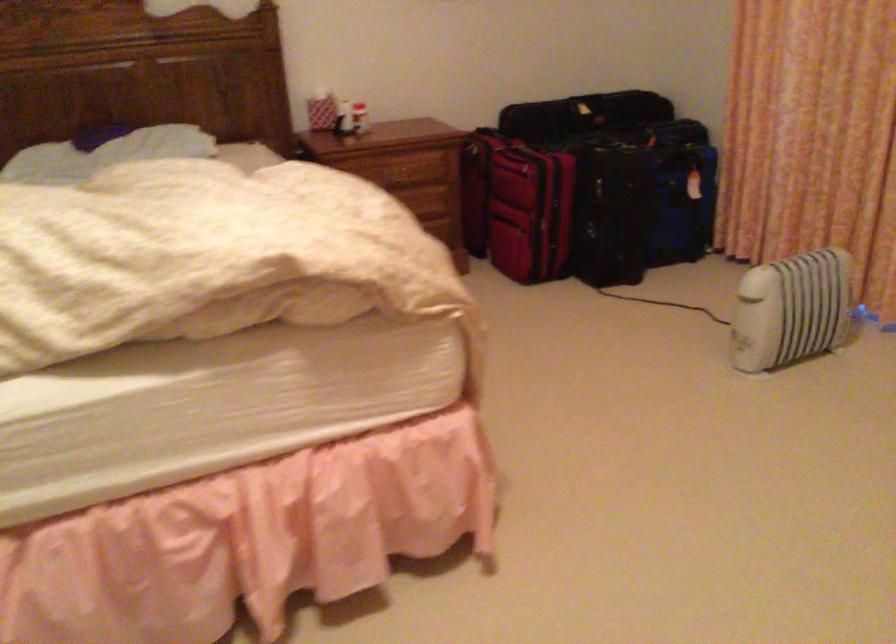
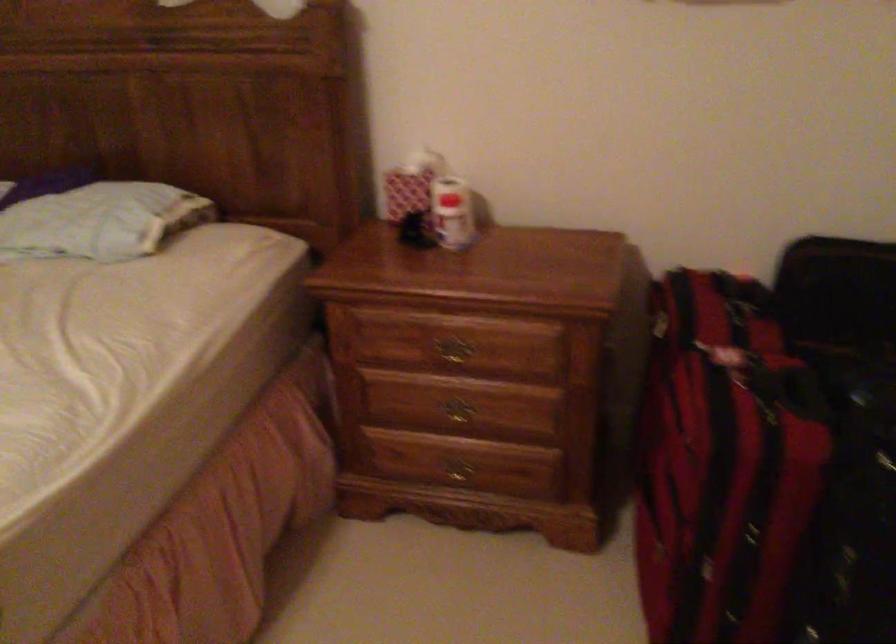
Find the pixel in the second image that matches the point at 316,99 in the first image.

(410, 184)